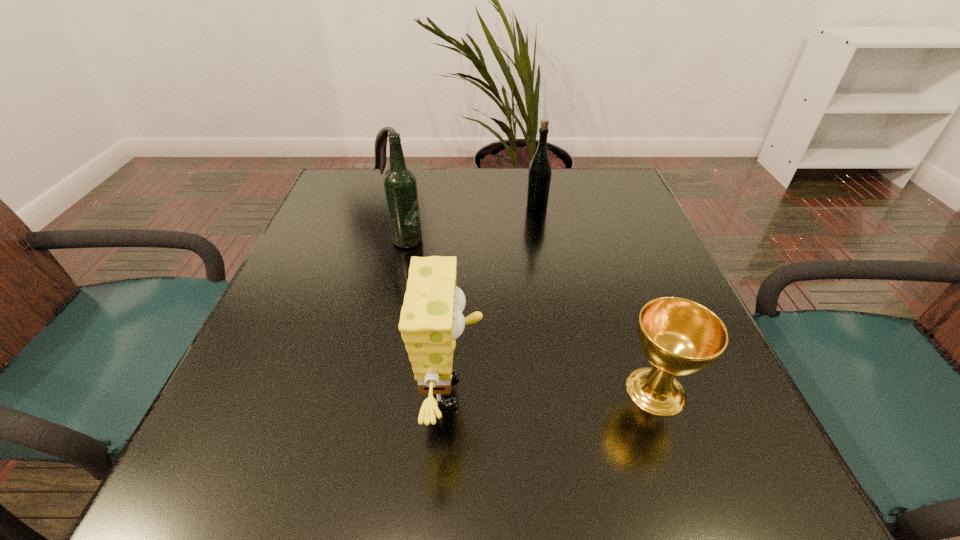
Locate an element on the screen. The height and width of the screenshot is (540, 960). vacant space located on the right of the shortest object is located at coordinates (736, 391).

This screenshot has height=540, width=960. In order to click on object that is positioned at the far edge in this screenshot , I will do `click(539, 177)`.

Identify the location of object that is at the near edge. Image resolution: width=960 pixels, height=540 pixels. (431, 318).

The image size is (960, 540). Find the location of `object situated at the right edge`. object situated at the right edge is located at coordinates (680, 337).

Identify the location of free spot at the far edge of the desktop. This screenshot has height=540, width=960. (519, 185).

You are a GUI agent. You are given a task and a screenshot of the screen. Output one action in this format:
    pyautogui.click(x=<x>, y=<y>)
    Task: Click on the blank space at the near edge
    
    Given the screenshot: What is the action you would take?
    pyautogui.click(x=405, y=481)

In the image, there is a desktop. At what (x,y) coordinates should I click in order to perform the action: click on blank space at the left edge. Please return your answer as a coordinate pair (x, y). This screenshot has height=540, width=960. Looking at the image, I should click on (261, 345).

The image size is (960, 540). In the image, there is a desktop. What are the coordinates of `free space at the right edge` in the screenshot? It's located at (594, 222).

This screenshot has width=960, height=540. Identify the location of vacant space at the far left corner of the desktop. (365, 167).

In the image, there is a desktop. In order to click on free space at the near left corner in this screenshot , I will do `click(232, 462)`.